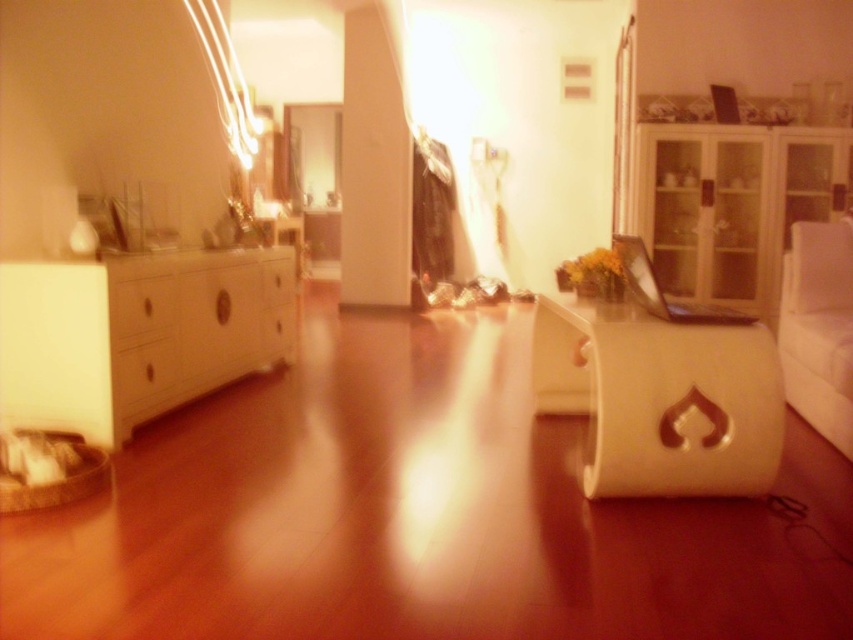
Question: Can you confirm if transparent glass cabinet at right is bigger than white matte drawer at lower left?

Choices:
 (A) no
 (B) yes

Answer: (B)

Question: Which point is farther to the camera?

Choices:
 (A) white fabric couch at right
 (B) white glossy dresser at left
 (C) transparent glass cabinet at right

Answer: (C)

Question: Which point is closer to the camera?

Choices:
 (A) (149, 384)
 (B) (815, 368)

Answer: (A)

Question: Does white glossy dresser at left appear under white matte cylindrical at center?

Choices:
 (A) no
 (B) yes

Answer: (A)

Question: Where is white glossy dresser at left located in relation to white fabric couch at right in the image?

Choices:
 (A) right
 (B) left

Answer: (B)

Question: Which object appears farthest from the camera in this image?

Choices:
 (A) white matte cylindrical at center
 (B) white glossy dresser at left

Answer: (B)